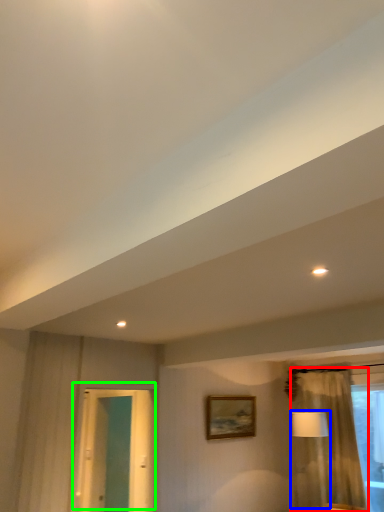
Question: Estimate the real-world distances between objects in this image. Which object is closer to curtain (highlighted by a red box), table lamp (highlighted by a blue box) or door (highlighted by a green box)?

Choices:
 (A) table lamp
 (B) door

Answer: (A)